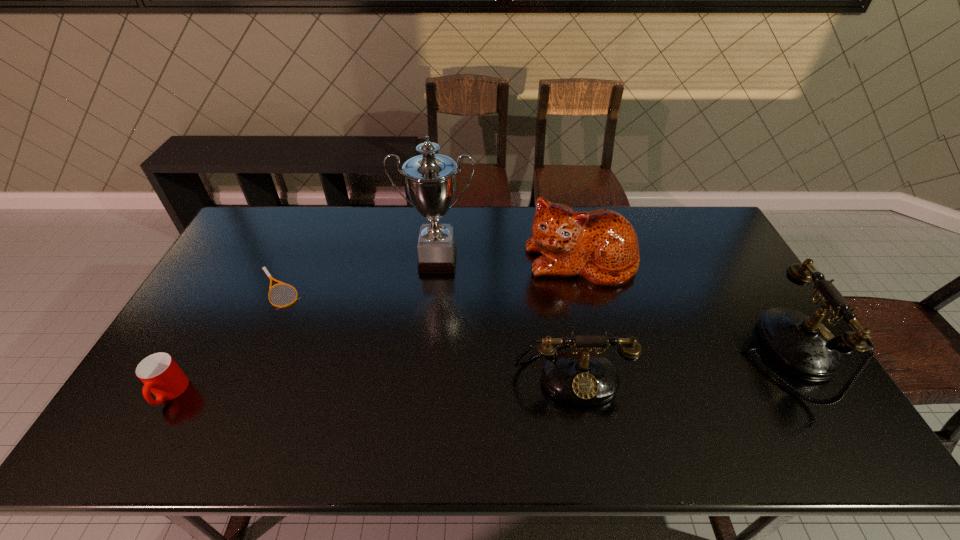
Where is `vacant space in between the fourth tallest object and the tennis racket`? vacant space in between the fourth tallest object and the tennis racket is located at coordinates (424, 331).

Identify the location of free space between the shorter telephone and the taller telephone. (679, 363).

You are a GUI agent. You are given a task and a screenshot of the screen. Output one action in this format:
    pyautogui.click(x=<x>, y=<y>)
    Task: Click on the free space between the trophy cup and the fifth object from right to left
    The height and width of the screenshot is (540, 960).
    Given the screenshot: What is the action you would take?
    pyautogui.click(x=358, y=275)

Image resolution: width=960 pixels, height=540 pixels. Identify the location of vacant point located between the cat and the trophy cup. (509, 261).

Locate an element on the screen. unoccupied area between the cup and the third object from left to right is located at coordinates (303, 327).

The width and height of the screenshot is (960, 540). I want to click on unoccupied area between the tallest object and the fifth object from right to left, so click(358, 275).

Locate an element on the screen. This screenshot has width=960, height=540. blank region between the cup and the rightmost object is located at coordinates (478, 374).

Where is `the fourth closest object to the cat`? Image resolution: width=960 pixels, height=540 pixels. the fourth closest object to the cat is located at coordinates tap(271, 278).

Point out which object is positioned as the fourth nearest to the second object from left to right. Please provide its 2D coordinates. Your answer should be formatted as a tuple, i.e. [(x, y)], where the tuple contains the x and y coordinates of a point satisfying the conditions above.

[(601, 245)]

The width and height of the screenshot is (960, 540). Identify the location of vacant space that satisfies the following two spatial constraints: 1. on the dial of the right telephone; 2. on the dial of the shorter telephone. (799, 373).